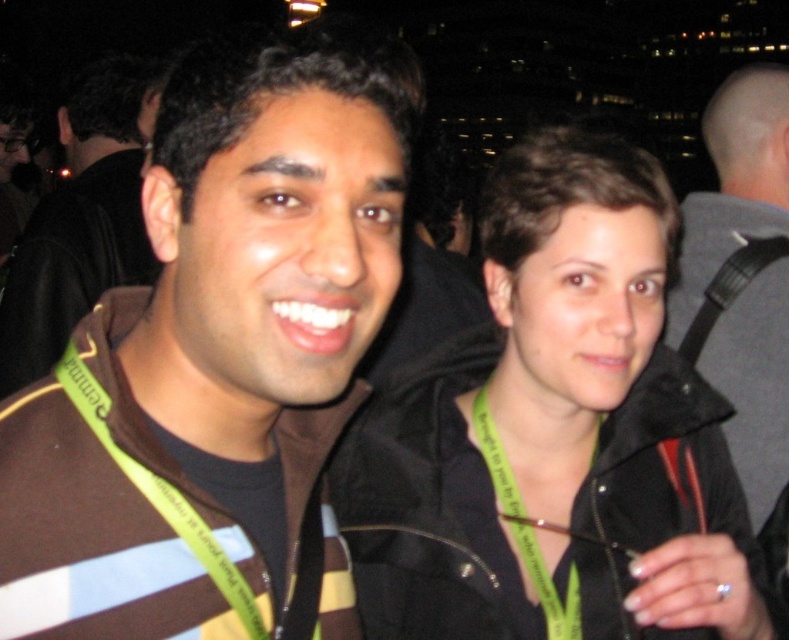
Question: Among these points, which one is farthest from the camera?

Choices:
 (A) (103, 604)
 (B) (756, 381)
 (C) (509, 500)
 (D) (670, 628)

Answer: (B)

Question: Among these points, which one is farthest from the camera?

Choices:
 (A) (73, 128)
 (B) (733, 532)

Answer: (A)

Question: Is black matte jacket at center smaller than black leather strap at right?

Choices:
 (A) yes
 (B) no

Answer: (B)

Question: Which point is closer to the camera?

Choices:
 (A) gray fabric jacket at upper right
 (B) black matte jacket at center
 (C) green fabric lanyard at center
 (D) brown striped sweater at left

Answer: (B)

Question: From the image, what is the correct spatial relationship of brown striped sweater at center in relation to green fabric lanyard at center?

Choices:
 (A) right
 (B) left

Answer: (B)

Question: Is black matte jacket at center above gray fabric jacket at upper right?

Choices:
 (A) no
 (B) yes

Answer: (A)